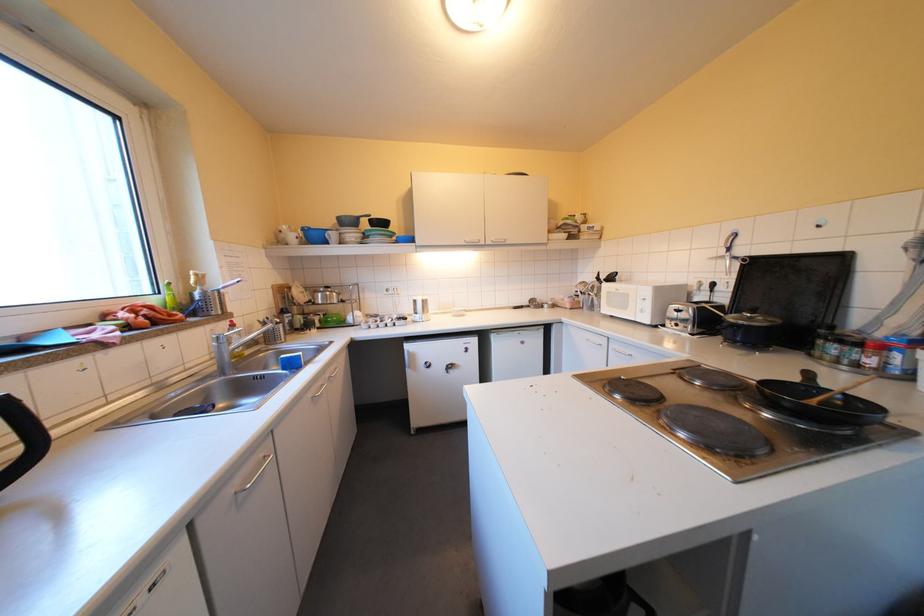
What do you see at coordinates (169, 297) in the screenshot?
I see `the green spray bottle` at bounding box center [169, 297].